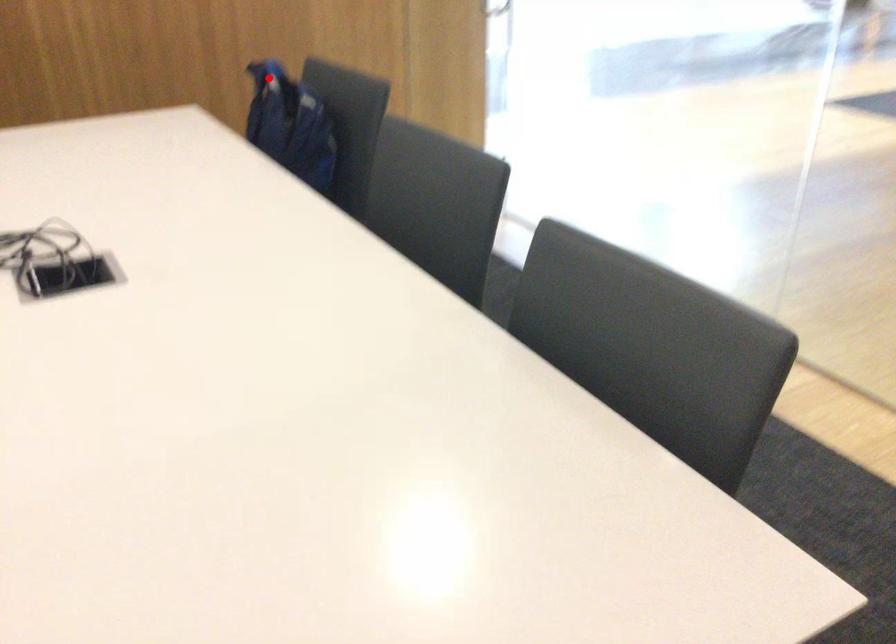
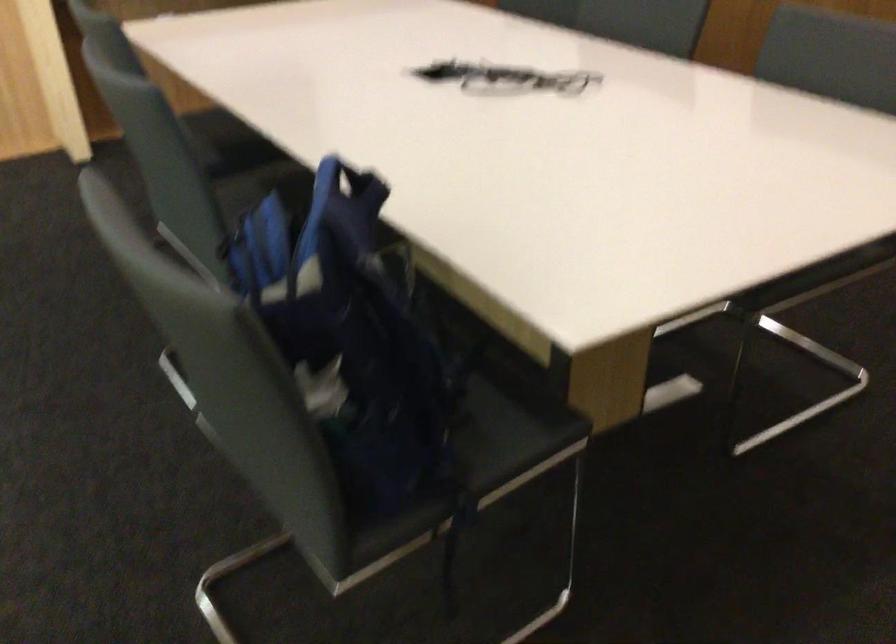
Question: A red point is marked in image1. In image2, is the corresponding 3D point closer to the camera or farther? Reply with the corresponding letter.

Choices:
 (A) The corresponding 3D point is closer.
 (B) The corresponding 3D point is farther.

Answer: (A)